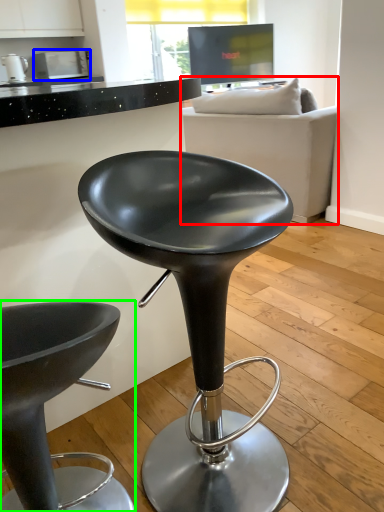
Question: Estimate the real-world distances between objects in this image. Which object is closer to studio couch (highlighted by a red box), appliance (highlighted by a blue box) or chair (highlighted by a green box)?

Choices:
 (A) appliance
 (B) chair

Answer: (B)